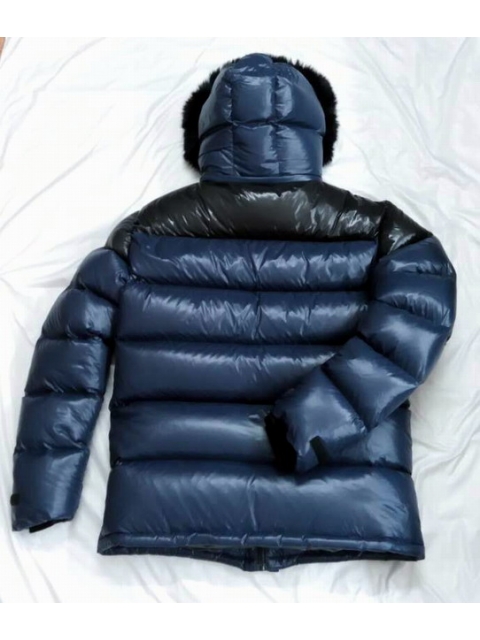
You are a GUI agent. You are given a task and a screenshot of the screen. Output one action in this format:
    pyautogui.click(x=<x>, y=<y>)
    Task: Click on the sheet
    The image size is (480, 640).
    Given the screenshot: What is the action you would take?
    pyautogui.click(x=453, y=470)